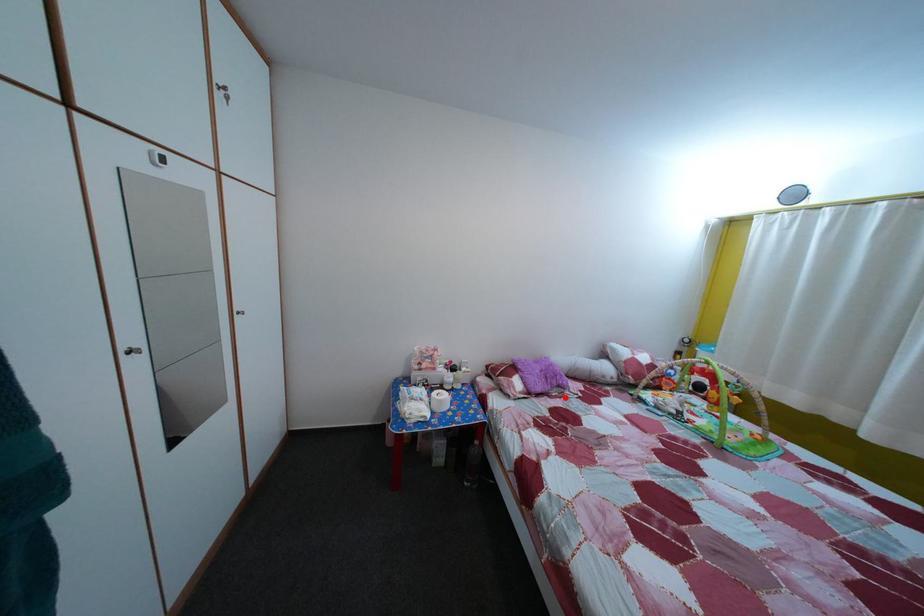
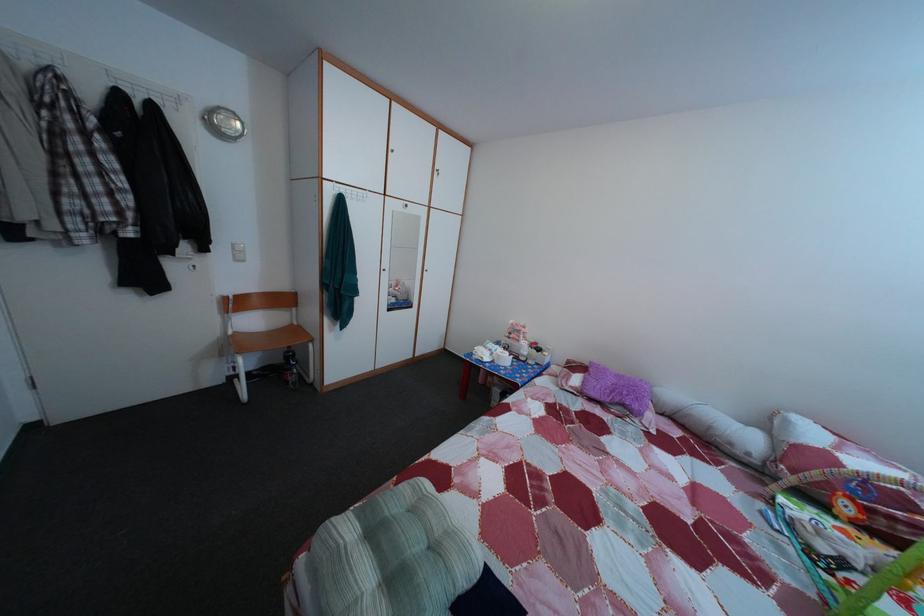
Locate, in the second image, the point that corresponds to the highlighted location in the first image.

(628, 416)